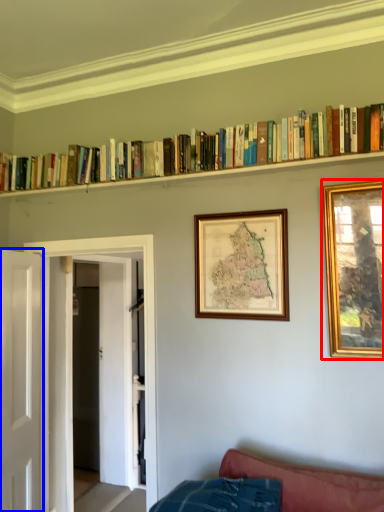
Question: Which point is further to the camera, picture frame (highlighted by a red box) or door (highlighted by a blue box)?

Choices:
 (A) picture frame
 (B) door

Answer: (B)